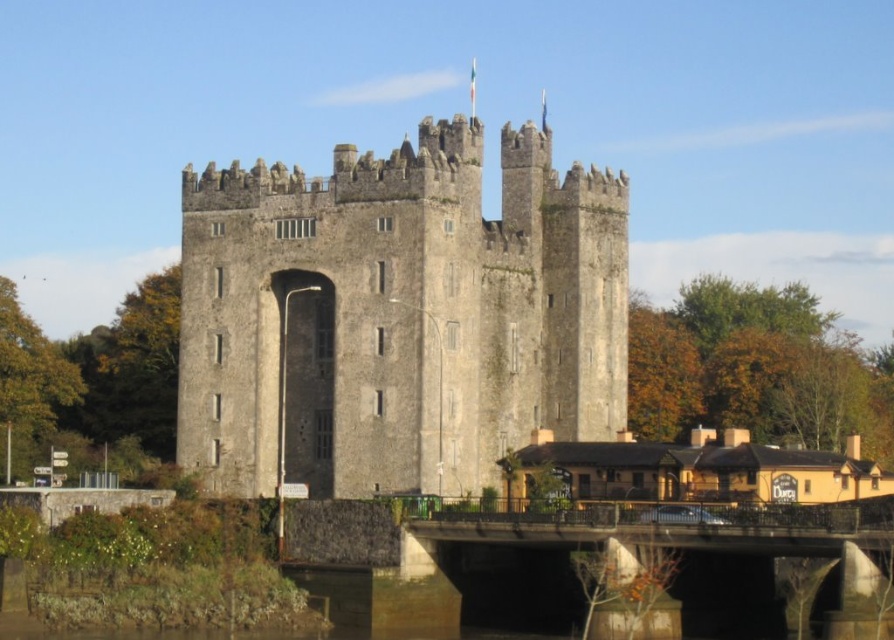
Does gray stone castle at center appear on the right side of concrete bridge at lower center?

In fact, gray stone castle at center is to the left of concrete bridge at lower center.

Can you confirm if gray stone castle at center is wider than concrete bridge at lower center?

Yes, gray stone castle at center is wider than concrete bridge at lower center.

Who is more forward, (393, 483) or (820, 618)?

Positioned in front is point (820, 618).

The width and height of the screenshot is (894, 640). What are the coordinates of `gray stone castle at center` in the screenshot? It's located at (398, 316).